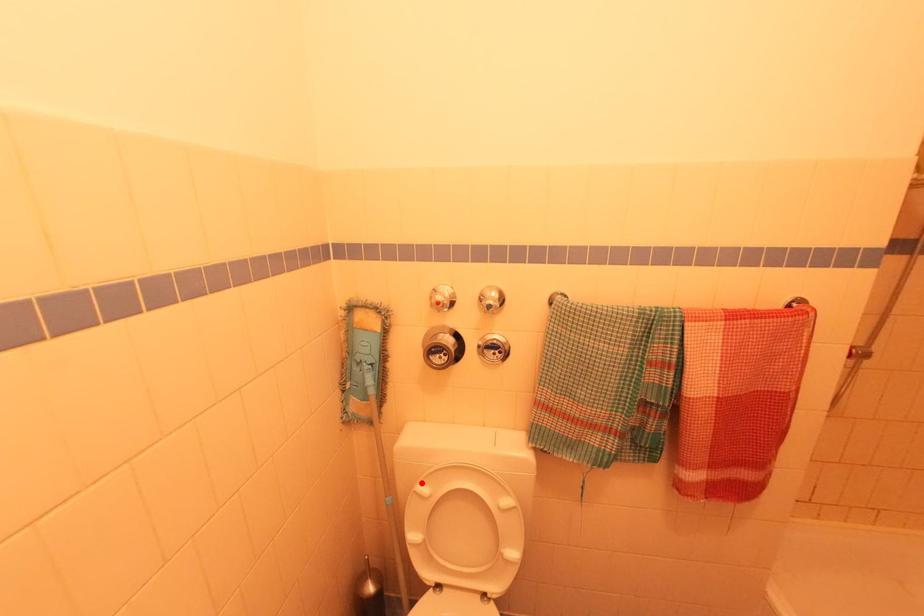
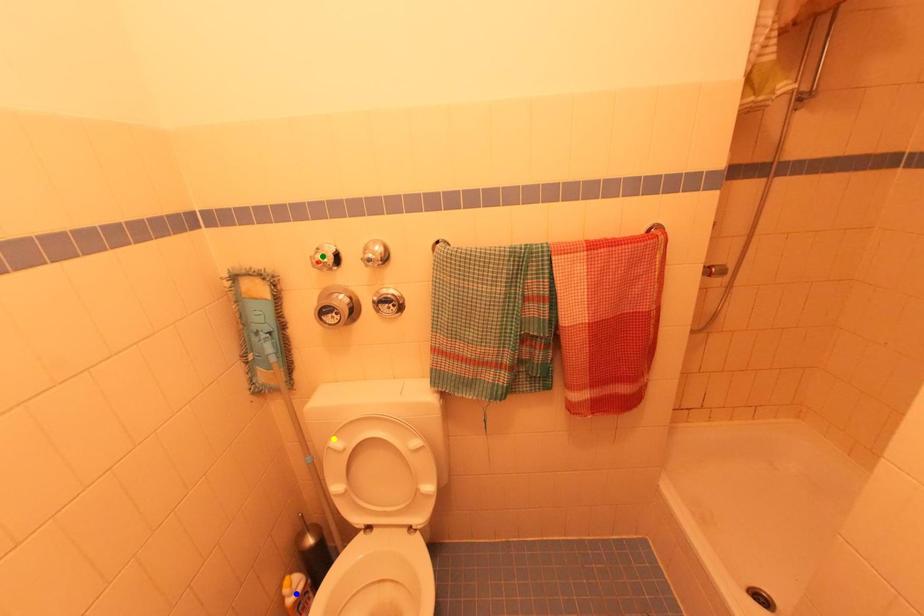
Question: I am providing you with two images of the same scene from different viewpoints. A red point is marked on the first image. You are given multiple points on the second image. Which spot in image 2 lines up with the point in image 1?

Choices:
 (A) green point
 (B) yellow point
 (C) blue point

Answer: (B)